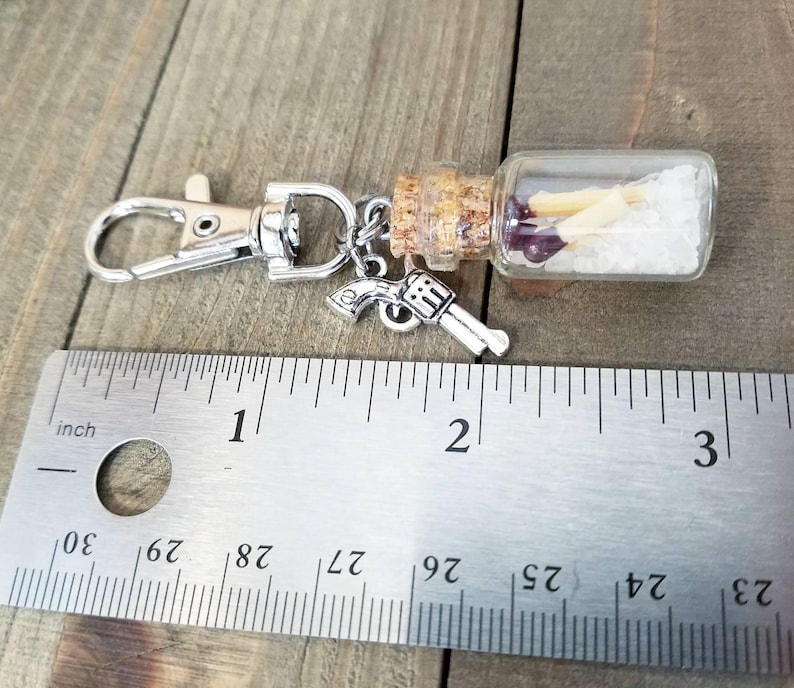
The height and width of the screenshot is (688, 794). What are the coordinates of `cork` in the screenshot? It's located at click(x=398, y=230).